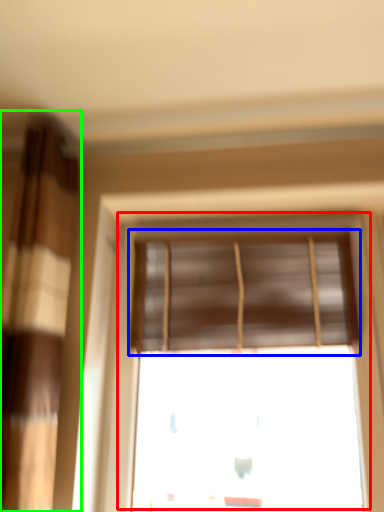
Question: Estimate the real-world distances between objects in this image. Which object is closer to window (highlighted by a red box), window blind (highlighted by a blue box) or curtain (highlighted by a green box)?

Choices:
 (A) window blind
 (B) curtain

Answer: (A)